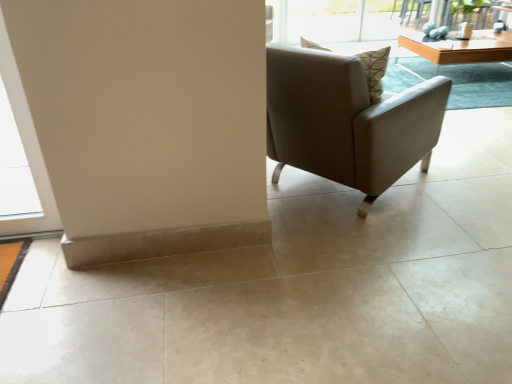
This screenshot has width=512, height=384. What do you see at coordinates (347, 121) in the screenshot?
I see `matte gray armchair at center` at bounding box center [347, 121].

The height and width of the screenshot is (384, 512). What are the coordinates of `matte gray armchair at center` in the screenshot? It's located at (347, 121).

In order to face matte gray armchair at center, should I rotate leftwards or rightwards?

Turn right by 11.915 degrees to look at matte gray armchair at center.

What do you see at coordinates (459, 47) in the screenshot? The height and width of the screenshot is (384, 512). I see `light brown wooden table at upper right` at bounding box center [459, 47].

Locate an element on the screen. Image resolution: width=512 pixels, height=384 pixels. light brown wooden table at upper right is located at coordinates (459, 47).

Where is `matte gray armchair at center`? The image size is (512, 384). matte gray armchair at center is located at coordinates (347, 121).

Which object is positioned more to the left, light brown wooden table at upper right or matte gray armchair at center?

From the viewer's perspective, matte gray armchair at center appears more on the left side.

Which is behind, light brown wooden table at upper right or matte gray armchair at center?

light brown wooden table at upper right is further away from the camera.

Which is in front, point (431, 49) or point (320, 70)?

Point (320, 70)

From the image's perspective, between light brown wooden table at upper right and matte gray armchair at center, which one is located above?

light brown wooden table at upper right is shown above in the image.

From the picture: From a real-world perspective, is light brown wooden table at upper right located higher than matte gray armchair at center?

No, from a real-world perspective, light brown wooden table at upper right is not over matte gray armchair at center

Which object is wider, light brown wooden table at upper right or matte gray armchair at center?

matte gray armchair at center.

Can you confirm if light brown wooden table at upper right is taller than matte gray armchair at center?

No, light brown wooden table at upper right is not taller than matte gray armchair at center.

Can you confirm if light brown wooden table at upper right is smaller than matte gray armchair at center?

Yes.

Which is correct: light brown wooden table at upper right is inside matte gray armchair at center, or outside of it?

light brown wooden table at upper right is not inside matte gray armchair at center, it's outside.

Is light brown wooden table at upper right next to matte gray armchair at center and touching it?

light brown wooden table at upper right and matte gray armchair at center are clearly separated.

Is light brown wooden table at upper right facing towards matte gray armchair at center?

No, light brown wooden table at upper right is not turned towards matte gray armchair at center.

What's the angular difference between light brown wooden table at upper right and matte gray armchair at center's facing directions?

The angular difference between light brown wooden table at upper right and matte gray armchair at center is 126 degrees.

Find the location of a particular element. The image size is (512, 384). table that is on the right side of matte gray armchair at center is located at coordinates (459, 47).

Which is more to the left, matte gray armchair at center or light brown wooden table at upper right?

matte gray armchair at center.

Considering their positions, is matte gray armchair at center located in front of or behind light brown wooden table at upper right?

Clearly, matte gray armchair at center is in front of light brown wooden table at upper right.

Considering the points (305, 163) and (467, 55), which point is behind, point (305, 163) or point (467, 55)?

The point (467, 55) is farther from the camera.

From the image's perspective, which is above, matte gray armchair at center or light brown wooden table at upper right?

light brown wooden table at upper right, from the image's perspective.

From a real-world perspective, which object rests below the other?

In real-world perspective, light brown wooden table at upper right is lower.

Which of these two, matte gray armchair at center or light brown wooden table at upper right, is thinner?

With smaller width is light brown wooden table at upper right.

Who is taller, matte gray armchair at center or light brown wooden table at upper right?

Standing taller between the two is matte gray armchair at center.

Based on their sizes in the image, would you say matte gray armchair at center is bigger or smaller than light brown wooden table at upper right?

In the image, matte gray armchair at center appears to be larger than light brown wooden table at upper right.

Is matte gray armchair at center completely or partially outside of light brown wooden table at upper right?

That's correct, matte gray armchair at center is outside of light brown wooden table at upper right.

Would you consider matte gray armchair at center to be distant from light brown wooden table at upper right?

Absolutely, matte gray armchair at center is distant from light brown wooden table at upper right.

Is matte gray armchair at center looking in the opposite direction of light brown wooden table at upper right?

That's not correct — matte gray armchair at center is not looking away from light brown wooden table at upper right.

How distant is matte gray armchair at center from light brown wooden table at upper right?

The distance of matte gray armchair at center from light brown wooden table at upper right is 8.73 feet.

The height and width of the screenshot is (384, 512). In order to click on chair in front of the light brown wooden table at upper right in this screenshot , I will do `click(347, 121)`.

The width and height of the screenshot is (512, 384). I want to click on chair on the left of light brown wooden table at upper right, so click(x=347, y=121).

Locate an element on the screen. Image resolution: width=512 pixels, height=384 pixels. chair above the light brown wooden table at upper right (from a real-world perspective) is located at coordinates click(x=347, y=121).